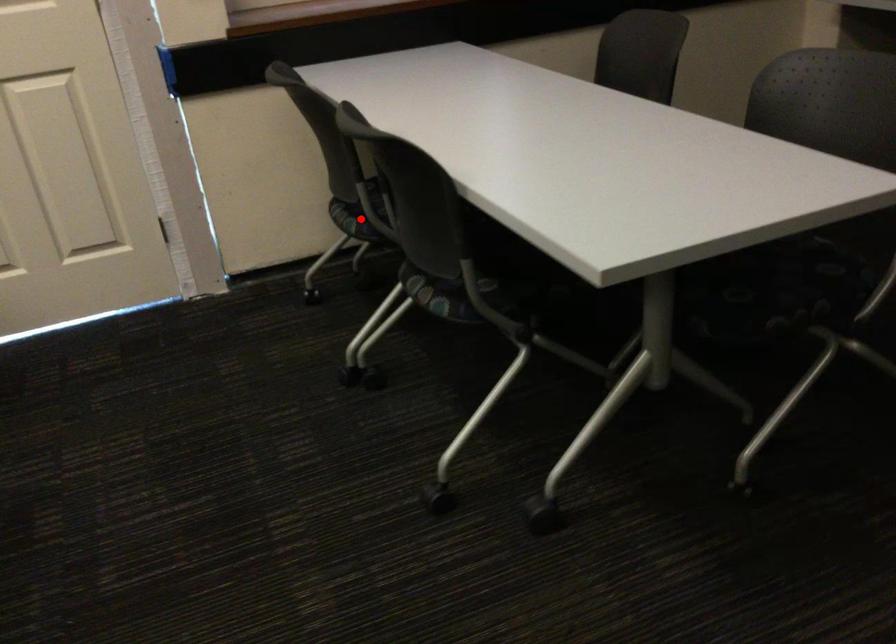
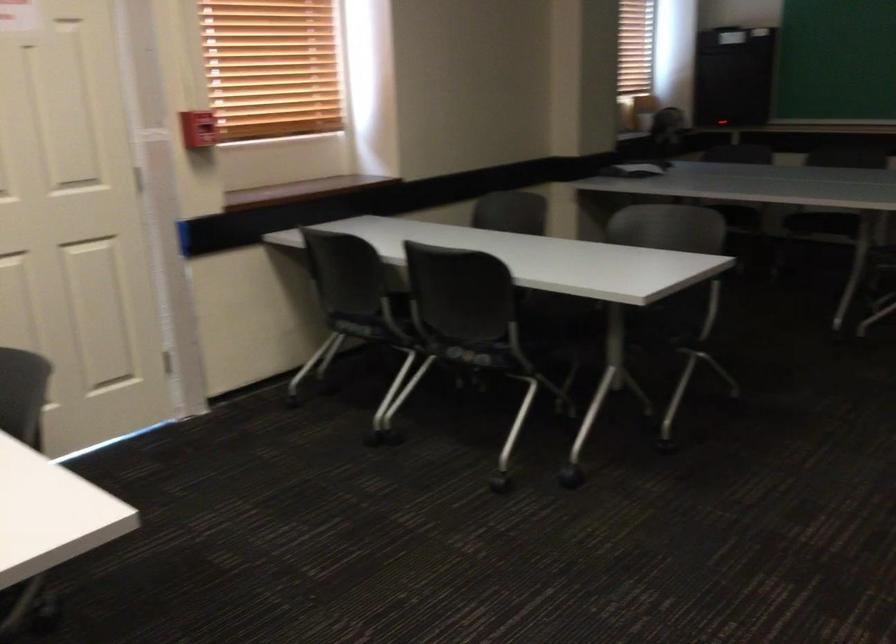
Question: A red point is marked in image1. In image2, is the corresponding 3D point closer to the camera or farther? Reply with the corresponding letter.

Choices:
 (A) The corresponding 3D point is closer.
 (B) The corresponding 3D point is farther.

Answer: (B)